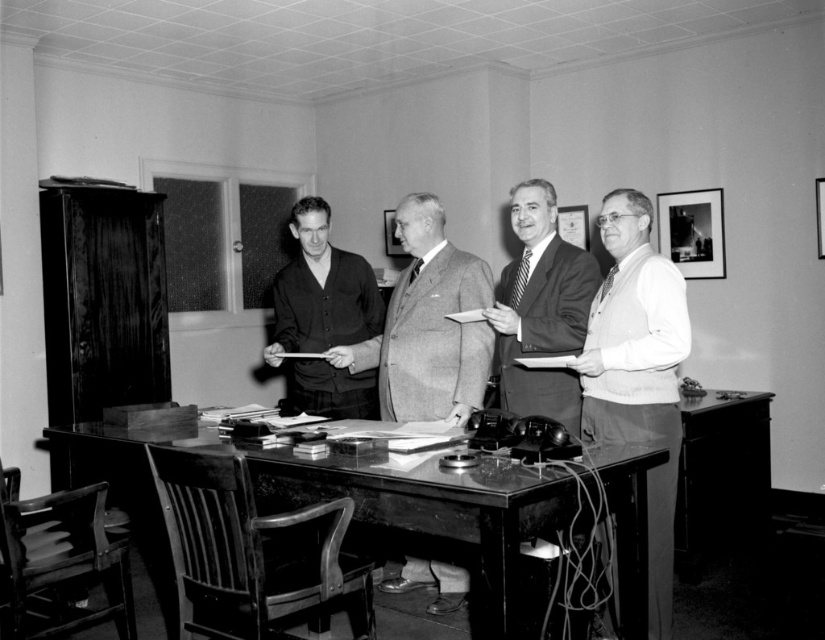
You are an event planner organizing a photo shoot in this office scene. You need to place a large banner behind the two men in smooth gray suit at center and smooth dark suit at center. Which man should the banner be placed behind to ensure it is visible to all attendees?

The banner should be placed behind the smooth gray suit at center because it is larger and will provide a better backdrop for visibility.